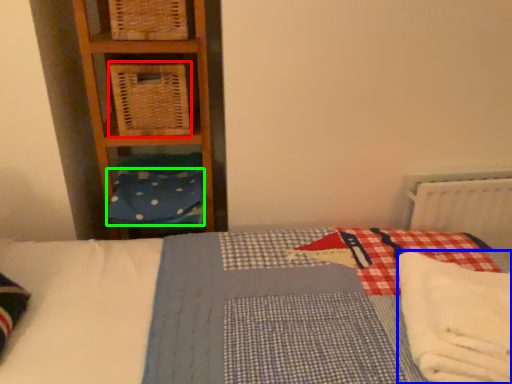
Question: Which object is the farthest from crate (highlighted by a red box)? Choose among these: material (highlighted by a blue box) or pillow (highlighted by a green box).

Choices:
 (A) material
 (B) pillow

Answer: (A)